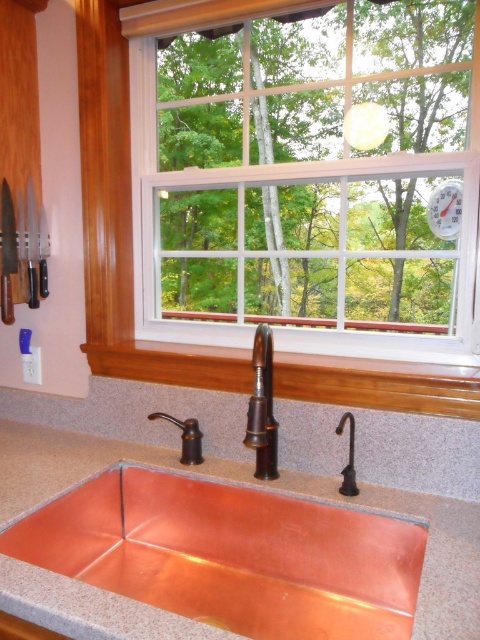
You are a kitchen designer planning to install a new copper metallic faucet at center next to the existing copper metallic sink at center. Based on the current setup, will the new faucet be taller than the sink?

The copper metallic sink at center is not as tall as the copper metallic faucet at center, so yes, the new faucet will be taller than the sink.

You are a window cleaner with a 1.2 meter long pole. You are standing in the kitchen sink area and want to clean the white plastic window at upper center. Can you reach it with your pole?

The distance between you and the white plastic window at upper center is 1.21 meters. Since your pole is 1.2 meters long, it is slightly shorter than the required distance. You might need a longer pole or an extension to reach it.

You are a kitchen designer planning to install a new shelf between the copper metallic sink at center and the metallic silver clock at upper right. Based on their positions, which object should the shelf be closer to?

The shelf should be closer to the metallic silver clock at upper right because the copper metallic sink at center is to the left of the metallic silver clock at upper right, meaning the clock is positioned further to the right.